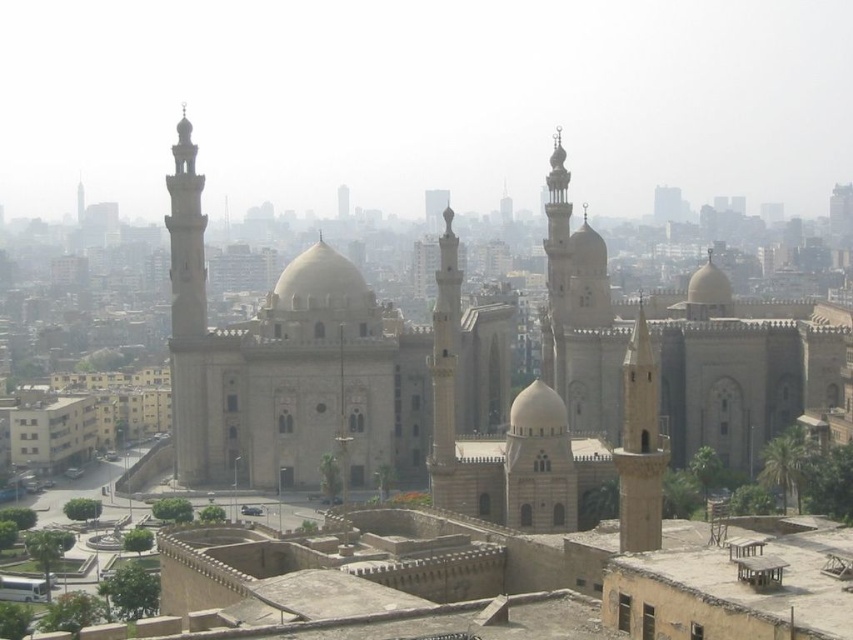
Question: Does beige stone minaret at center right have a greater width compared to light beige stone minaret at center-right?

Choices:
 (A) no
 (B) yes

Answer: (B)

Question: Among these objects, which one is farthest from the camera?

Choices:
 (A) light beige stone minaret at left
 (B) light beige stone minaret at center-right
 (C) beige stone minaret at center right

Answer: (A)

Question: Can you confirm if light beige stone minaret at center-right is positioned below light beige stone minaret at left?

Choices:
 (A) yes
 (B) no

Answer: (A)

Question: Which object is farther from the camera taking this photo?

Choices:
 (A) light beige stone minaret at center-right
 (B) beige stone minaret at center right
 (C) light beige stone minaret at left

Answer: (C)

Question: Among these points, which one is farthest from the camera?

Choices:
 (A) coord(170,280)
 (B) coord(560,140)

Answer: (B)

Question: Can you confirm if light beige stone minaret at center-right is positioned to the right of light beige stone minaret at left?

Choices:
 (A) no
 (B) yes

Answer: (B)